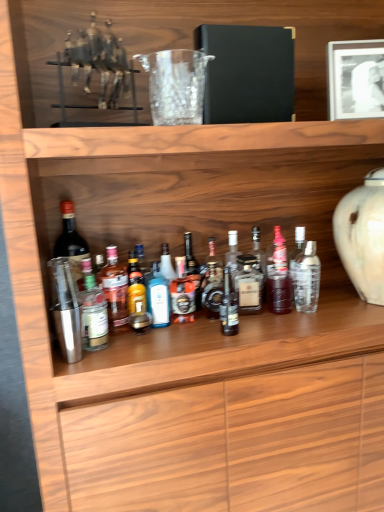
Question: Is metallic silver horse at upper left at the right side of metallic silver shaker at center-left, the 2th bottle when ordered from left to right?

Choices:
 (A) no
 (B) yes

Answer: (B)

Question: Is metallic silver horse at upper left further to the viewer compared to metallic silver shaker at center-left, the 2th bottle when ordered from left to right?

Choices:
 (A) yes
 (B) no

Answer: (B)

Question: From a real-world perspective, is metallic silver horse at upper left located higher than metallic silver shaker at center-left, the 2th bottle when ordered from left to right?

Choices:
 (A) no
 (B) yes

Answer: (B)

Question: Is metallic silver horse at upper left in front of metallic silver shaker at center-left, positioned as the 12th bottle in right-to-left order?

Choices:
 (A) no
 (B) yes

Answer: (B)

Question: Is metallic silver horse at upper left at the left side of metallic silver shaker at center-left, positioned as the 12th bottle in right-to-left order?

Choices:
 (A) yes
 (B) no

Answer: (B)

Question: From a real-world perspective, is translucent glass bottle at center, the 10th bottle from the right, physically located above or below clear glass bottle at center, which appears as the twelfth bottle when viewed from the left?

Choices:
 (A) above
 (B) below

Answer: (B)

Question: Looking at their shapes, would you say translucent glass bottle at center, marked as the 4th bottle in a left-to-right arrangement, is wider or thinner than clear glass bottle at center, which is the 2th bottle from right to left?

Choices:
 (A) thin
 (B) wide

Answer: (A)

Question: Visually, is translucent glass bottle at center, marked as the 4th bottle in a left-to-right arrangement, positioned to the left or to the right of clear glass bottle at center, which appears as the twelfth bottle when viewed from the left?

Choices:
 (A) left
 (B) right

Answer: (A)

Question: Considering the positions of translucent glass bottle at center, marked as the 4th bottle in a left-to-right arrangement, and clear glass bottle at center, which appears as the twelfth bottle when viewed from the left, in the image, is translucent glass bottle at center, marked as the 4th bottle in a left-to-right arrangement, bigger or smaller than clear glass bottle at center, which appears as the twelfth bottle when viewed from the left,?

Choices:
 (A) small
 (B) big

Answer: (A)

Question: Does point (216, 311) appear closer or farther from the camera than point (160, 54)?

Choices:
 (A) closer
 (B) farther

Answer: (B)

Question: Is shiny gold bottle at center, the eighth bottle in the left-to-right sequence, taller or shorter than transparent glass at center?

Choices:
 (A) tall
 (B) short

Answer: (A)

Question: Relative to transparent glass at center, is shiny gold bottle at center, the eighth bottle in the left-to-right sequence, in front or behind?

Choices:
 (A) front
 (B) behind

Answer: (B)

Question: Would you say shiny gold bottle at center, which ranks as the 6th bottle in right-to-left order, is to the left or to the right of transparent glass at center in the picture?

Choices:
 (A) left
 (B) right

Answer: (B)

Question: Is translucent glass bottle at center, acting as the eleventh bottle starting from the left, taller or shorter than translucent glass bottle at center, which appears as the 9th bottle when viewed from the right?

Choices:
 (A) tall
 (B) short

Answer: (A)

Question: Considering their positions, is translucent glass bottle at center, which ranks as the 3th bottle in right-to-left order, located in front of or behind translucent glass bottle at center, which appears as the 9th bottle when viewed from the right?

Choices:
 (A) front
 (B) behind

Answer: (B)